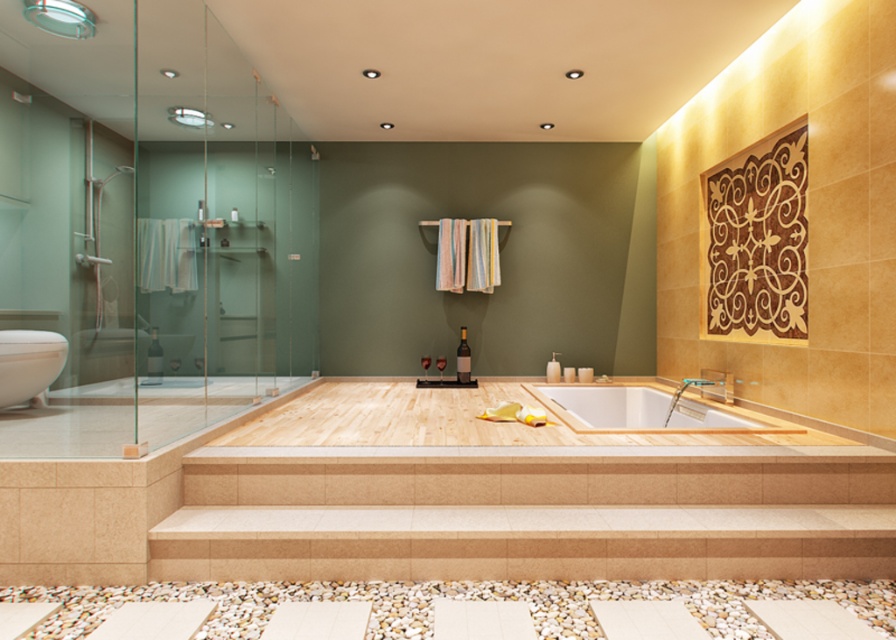
Question: Can you confirm if white wood bathtub at center is positioned above white glossy bathtub at lower left?

Choices:
 (A) no
 (B) yes

Answer: (A)

Question: Which of the following is the farthest from the observer?

Choices:
 (A) white glossy bathtub at lower left
 (B) white wood bathtub at center

Answer: (A)

Question: Which of the following is the farthest from the observer?

Choices:
 (A) (28, 392)
 (B) (636, 416)

Answer: (B)

Question: Does white wood bathtub at center appear on the left side of white glossy bathtub at lower left?

Choices:
 (A) no
 (B) yes

Answer: (A)

Question: Among these points, which one is farthest from the camera?

Choices:
 (A) (44, 364)
 (B) (645, 397)

Answer: (B)

Question: Is white wood bathtub at center wider than white glossy bathtub at lower left?

Choices:
 (A) yes
 (B) no

Answer: (A)